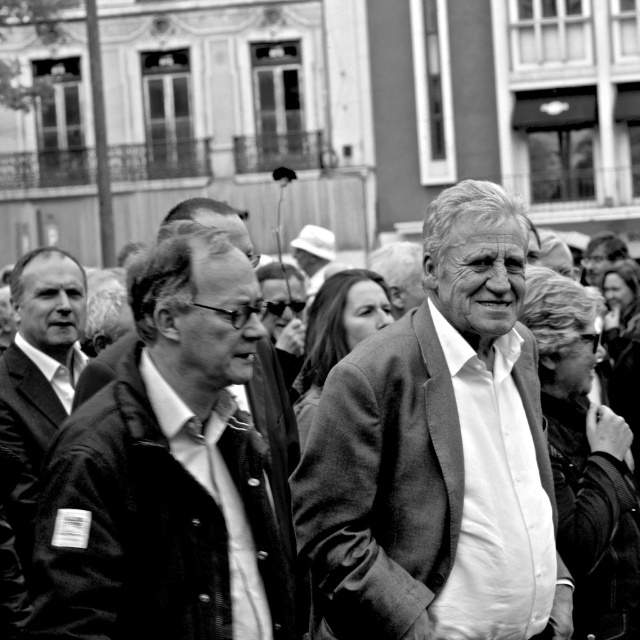
Question: In this image, where is smooth fabric jacket at center located relative to smooth gray blazer at center?

Choices:
 (A) left
 (B) right

Answer: (A)

Question: Among these points, which one is farthest from the camera?

Choices:
 (A) (54, 538)
 (B) (40, 412)

Answer: (B)

Question: Which point is closer to the camera taking this photo?

Choices:
 (A) (36, 401)
 (B) (276, 580)

Answer: (B)

Question: Is smooth gray blazer at center positioned at the back of smooth black suit at left?

Choices:
 (A) no
 (B) yes

Answer: (A)

Question: Is smooth gray blazer at center positioned before smooth black suit at left?

Choices:
 (A) no
 (B) yes

Answer: (B)

Question: Which of the following is the farthest from the observer?

Choices:
 (A) (112, 390)
 (B) (17, 301)
 (C) (305, 468)
 (D) (339, 525)

Answer: (B)